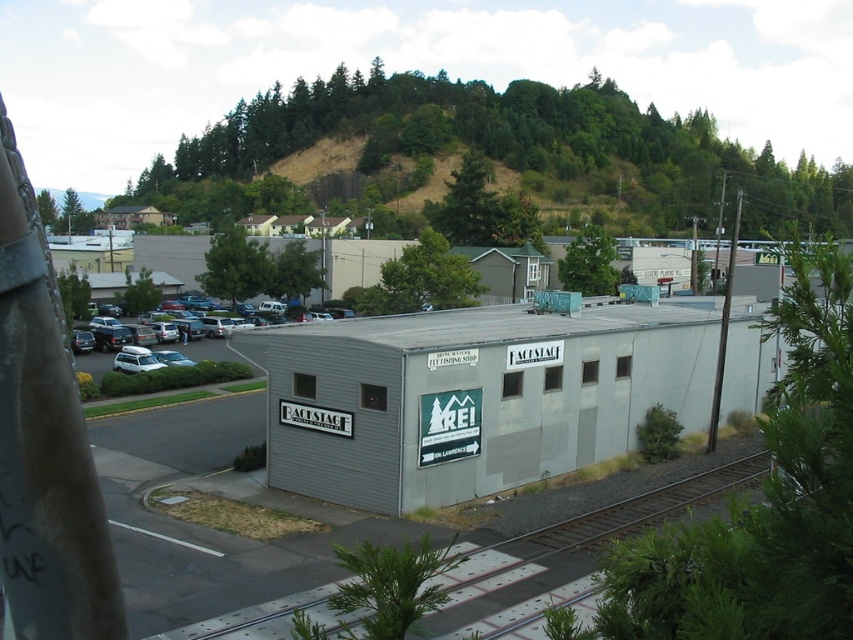
You are standing at the entrance of the gray matte building at center. If you walk straight ahead, will you face the railway or the parking lot?

The gray matte building at center is located such that walking straight ahead from its entrance would face the parking lot, as the railway is positioned to the right of the building according to the scene description.

You are a delivery driver who needs to park your white matte suv at center in a parking spot that requires the vehicle to be entirely within the boundaries of the gray matte building at center. Can you park your vehicle there based on the image?

The gray matte building at center might be wider than white matte suv at center, so it is possible that the parking spot within the building boundaries can accommodate the suv, but there is uncertainty due to the comparative width mentioned.